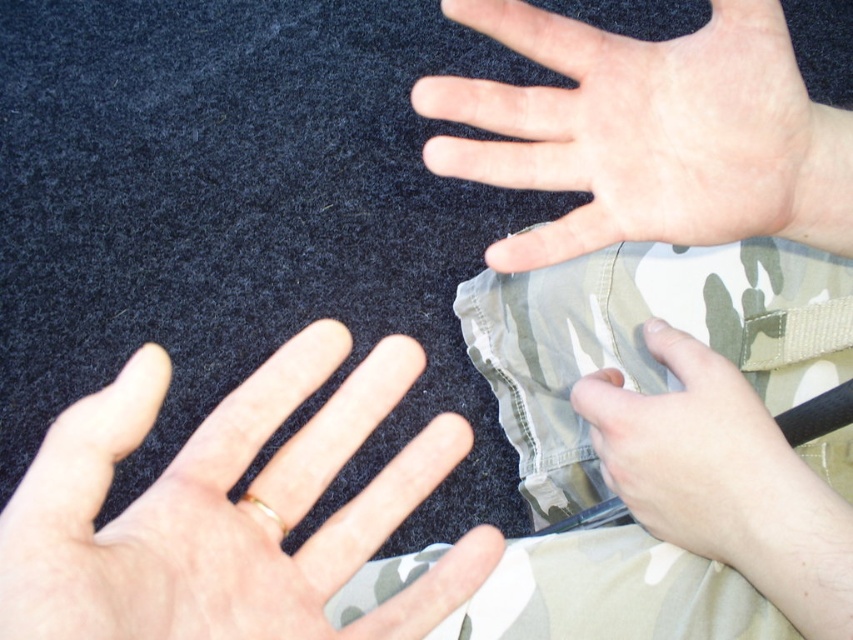
Question: Among these points, which one is nearest to the camera?

Choices:
 (A) (548, 28)
 (B) (750, 308)
 (C) (338, 566)

Answer: (C)

Question: Which object is closer to the camera taking this photo?

Choices:
 (A) camouflage fabric pants at center
 (B) smooth skin hand at lower left
 (C) pale skin at center
 (D) camouflage fabric hand at lower right

Answer: (B)

Question: Which object is farther from the camera taking this photo?

Choices:
 (A) smooth skin hand at lower left
 (B) camouflage fabric pants at center
 (C) pale skin at center

Answer: (B)

Question: Is smooth skin hand at lower left above pale skin at center?

Choices:
 (A) yes
 (B) no

Answer: (B)

Question: Can you confirm if camouflage fabric pants at center is bigger than pale skin at center?

Choices:
 (A) no
 (B) yes

Answer: (B)

Question: Does pale skin at center appear on the right side of camouflage fabric hand at lower right?

Choices:
 (A) yes
 (B) no

Answer: (B)